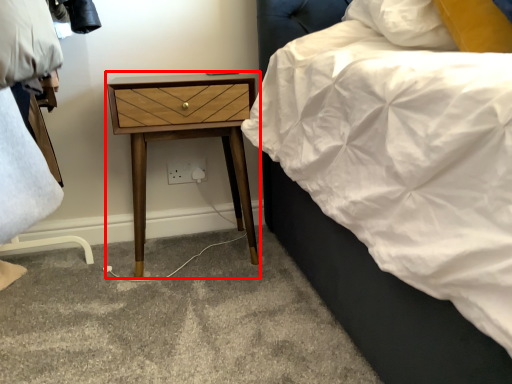
Question: In this image, where is nightstand (annotated by the red box) located relative to electric outlet?

Choices:
 (A) right
 (B) left

Answer: (A)